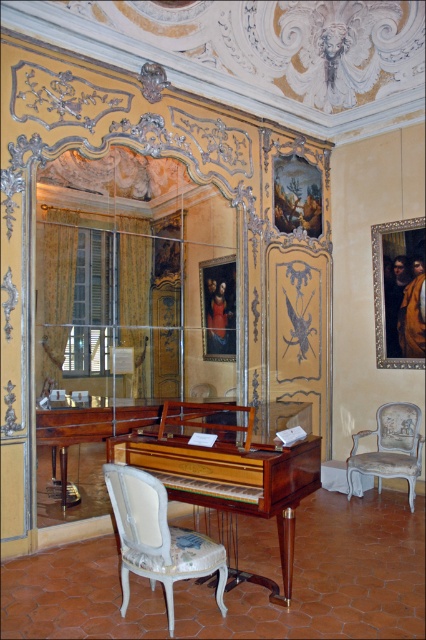
Question: Estimate the real-world distances between objects in this image. Which object is farther from the white upholstered armchair at lower left?

Choices:
 (A) light blue fabric armchair at lower right
 (B) mahogany polished piano at center

Answer: (A)

Question: Does white upholstered armchair at lower left have a larger size compared to light blue fabric armchair at lower right?

Choices:
 (A) no
 (B) yes

Answer: (A)

Question: Does mahogany polished piano at center have a lesser width compared to white upholstered armchair at lower left?

Choices:
 (A) yes
 (B) no

Answer: (B)

Question: Can you confirm if mahogany polished piano at center is positioned to the left of white upholstered armchair at lower left?

Choices:
 (A) no
 (B) yes

Answer: (A)

Question: Estimate the real-world distances between objects in this image. Which object is closer to the mahogany polished piano at center?

Choices:
 (A) white upholstered armchair at lower left
 (B) light blue fabric armchair at lower right

Answer: (A)

Question: Estimate the real-world distances between objects in this image. Which object is closer to the light blue fabric armchair at lower right?

Choices:
 (A) white upholstered armchair at lower left
 (B) mahogany polished piano at center

Answer: (B)